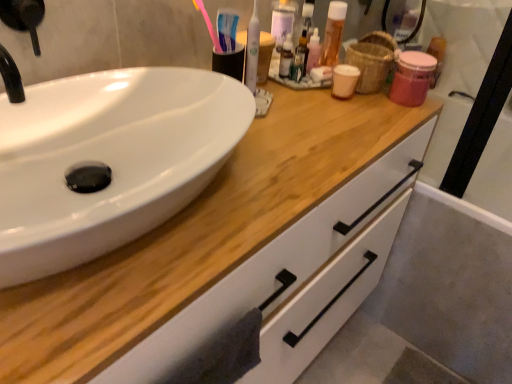
Question: Does wooden cabinet at center have a lesser width compared to pink plastic toothbrush at upper center?

Choices:
 (A) no
 (B) yes

Answer: (A)

Question: From the image's perspective, would you say wooden cabinet at center is positioned over pink plastic toothbrush at upper center?

Choices:
 (A) yes
 (B) no

Answer: (B)

Question: Does wooden cabinet at center turn towards pink plastic toothbrush at upper center?

Choices:
 (A) no
 (B) yes

Answer: (A)

Question: Is pink plastic toothbrush at upper center a part of wooden cabinet at center?

Choices:
 (A) no
 (B) yes

Answer: (A)

Question: Can you confirm if wooden cabinet at center is wider than pink plastic toothbrush at upper center?

Choices:
 (A) no
 (B) yes

Answer: (B)

Question: From a real-world perspective, is wooden cabinet at center on top of pink plastic toothbrush at upper center?

Choices:
 (A) yes
 (B) no

Answer: (B)

Question: Is translucent plastic mouthwash at upper center, which is the 2th mouthwash in left-to-right order, to the right of white plastic toothbrush at upper center, the first mouthwash positioned from the front, from the viewer's perspective?

Choices:
 (A) no
 (B) yes

Answer: (B)

Question: Can you confirm if translucent plastic mouthwash at upper center, positioned as the 1th mouthwash in back-to-front order, is positioned to the left of white plastic toothbrush at upper center, which ranks as the second mouthwash in back-to-front order?

Choices:
 (A) no
 (B) yes

Answer: (A)

Question: Considering the relative sizes of translucent plastic mouthwash at upper center, which is counted as the first mouthwash, starting from the right, and white plastic toothbrush at upper center, the first mouthwash positioned from the front, in the image provided, is translucent plastic mouthwash at upper center, which is counted as the first mouthwash, starting from the right, bigger than white plastic toothbrush at upper center, the first mouthwash positioned from the front,?

Choices:
 (A) yes
 (B) no

Answer: (A)

Question: From the image's perspective, does translucent plastic mouthwash at upper center, which is counted as the first mouthwash, starting from the right, appear higher than white plastic toothbrush at upper center, which appears as the second mouthwash when viewed from the right?

Choices:
 (A) yes
 (B) no

Answer: (A)

Question: From a real-world perspective, is translucent plastic mouthwash at upper center, which is the 2th mouthwash in left-to-right order, on white plastic toothbrush at upper center, the first mouthwash positioned from the front?

Choices:
 (A) yes
 (B) no

Answer: (B)

Question: Considering the relative sizes of translucent plastic mouthwash at upper center, positioned as the 1th mouthwash in back-to-front order, and white plastic toothbrush at upper center, the 1th mouthwash from the left, in the image provided, is translucent plastic mouthwash at upper center, positioned as the 1th mouthwash in back-to-front order, wider than white plastic toothbrush at upper center, the 1th mouthwash from the left,?

Choices:
 (A) no
 (B) yes

Answer: (B)

Question: Is white plastic toothbrush at upper center, which appears as the second mouthwash when viewed from the right, next to translucent plastic mouthwash at upper center, which is counted as the first mouthwash, starting from the right, and touching it?

Choices:
 (A) no
 (B) yes

Answer: (A)